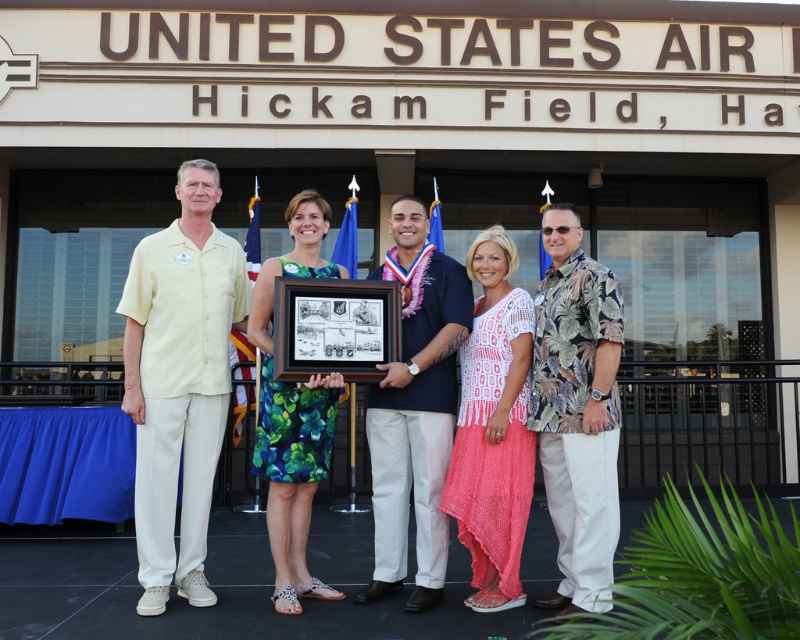
Is point (232, 305) in front of point (441, 413)?

No.

Consider the image. Does yellow textured shirt at left appear under dark blue shirt at center?

Incorrect, yellow textured shirt at left is not positioned below dark blue shirt at center.

This screenshot has height=640, width=800. What do you see at coordinates (180, 380) in the screenshot?
I see `yellow textured shirt at left` at bounding box center [180, 380].

Locate an element on the screen. yellow textured shirt at left is located at coordinates (180, 380).

Which is behind, point (160, 602) or point (620, 317)?

The point (160, 602) is behind.

Is yellow textured shirt at left positioned before hawaiian print shirt at right?

No, yellow textured shirt at left is behind hawaiian print shirt at right.

The height and width of the screenshot is (640, 800). I want to click on yellow textured shirt at left, so click(x=180, y=380).

Is green floral dress at center below dark blue shirt at center?

Indeed, green floral dress at center is positioned under dark blue shirt at center.

Between green floral dress at center and dark blue shirt at center, which one appears on the right side from the viewer's perspective?

dark blue shirt at center

From the picture: Who is more forward, (314, 196) or (414, 588)?

Positioned in front is point (414, 588).

Find the location of `green floral dress at center`. green floral dress at center is located at coordinates (425, 404).